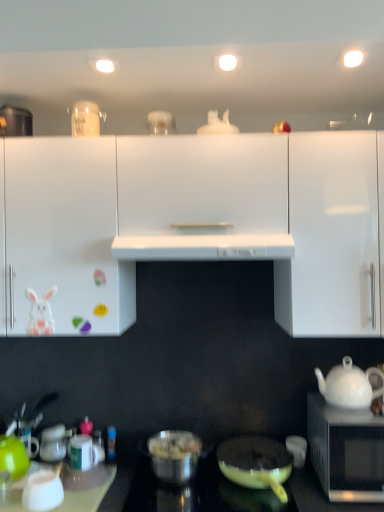
Question: Does matte yellow pan at lower center, the 1th pot/pan positioned from the right, have a lesser width compared to white glossy exhaust hood at center?

Choices:
 (A) yes
 (B) no

Answer: (A)

Question: Considering the relative positions of matte yellow pan at lower center, the 1th pot/pan positioned from the right, and white glossy exhaust hood at center in the image provided, is matte yellow pan at lower center, the 1th pot/pan positioned from the right, to the right of white glossy exhaust hood at center from the viewer's perspective?

Choices:
 (A) yes
 (B) no

Answer: (A)

Question: Does matte yellow pan at lower center, the 1th pot/pan positioned from the right, lie behind white glossy exhaust hood at center?

Choices:
 (A) yes
 (B) no

Answer: (A)

Question: Can you confirm if matte yellow pan at lower center, which ranks as the second pot/pan in left-to-right order, is taller than white glossy exhaust hood at center?

Choices:
 (A) no
 (B) yes

Answer: (B)

Question: Is matte yellow pan at lower center, which ranks as the second pot/pan in left-to-right order, closer to camera compared to white glossy exhaust hood at center?

Choices:
 (A) no
 (B) yes

Answer: (A)

Question: From a real-world perspective, is green matte coffee cup at lower left, which ranks as the first coffee cup in left-to-right order, positioned above or below shiny metallic pot at center, the 2th pot/pan when ordered from right to left?

Choices:
 (A) below
 (B) above

Answer: (B)

Question: Considering the positions of point (11, 438) and point (178, 443), is point (11, 438) closer or farther from the camera than point (178, 443)?

Choices:
 (A) closer
 (B) farther

Answer: (B)

Question: In terms of size, does green matte coffee cup at lower left, which is counted as the fourth coffee cup, starting from the right, appear bigger or smaller than shiny metallic pot at center, which is the 1th pot/pan from left to right?

Choices:
 (A) big
 (B) small

Answer: (B)

Question: Relative to shiny metallic pot at center, which is the 1th pot/pan from left to right, is green matte coffee cup at lower left, which ranks as the first coffee cup in left-to-right order, in front or behind?

Choices:
 (A) front
 (B) behind

Answer: (A)

Question: From the image's perspective, is white glossy cabinet at center, acting as the 2th cabinetry starting from the right, positioned above or below metallic silver pan at center?

Choices:
 (A) below
 (B) above

Answer: (B)

Question: Choose the correct answer: Is white glossy cabinet at center, acting as the 2th cabinetry starting from the right, inside metallic silver pan at center or outside it?

Choices:
 (A) inside
 (B) outside

Answer: (B)

Question: From a real-world perspective, is white glossy cabinet at center, the second cabinetry when ordered from left to right, positioned above or below metallic silver pan at center?

Choices:
 (A) above
 (B) below

Answer: (A)

Question: Is point (231, 143) positioned closer to the camera than point (142, 465)?

Choices:
 (A) farther
 (B) closer

Answer: (B)

Question: Considering the positions of green matte coffee cup at lower left, which ranks as the first coffee cup in left-to-right order, and white glossy cabinet at left, which is the 1th cabinetry in left-to-right order, in the image, is green matte coffee cup at lower left, which ranks as the first coffee cup in left-to-right order, wider or thinner than white glossy cabinet at left, which is the 1th cabinetry in left-to-right order,?

Choices:
 (A) wide
 (B) thin

Answer: (B)

Question: In the image, is green matte coffee cup at lower left, which ranks as the first coffee cup in left-to-right order, on the left side or the right side of white glossy cabinet at left, the 3th cabinetry positioned from the right?

Choices:
 (A) left
 (B) right

Answer: (A)